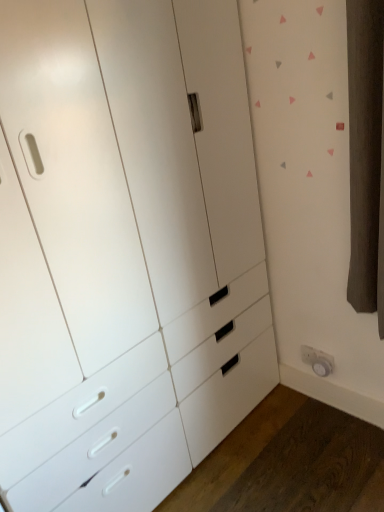
Question: From a real-world perspective, is white matte chest of drawers at center located beneath white plastic electric outlet at lower right?

Choices:
 (A) yes
 (B) no

Answer: (B)

Question: Can you confirm if white matte chest of drawers at center is wider than white plastic electric outlet at lower right?

Choices:
 (A) yes
 (B) no

Answer: (A)

Question: From the image's perspective, is white matte chest of drawers at center under white plastic electric outlet at lower right?

Choices:
 (A) no
 (B) yes

Answer: (A)

Question: Does white matte chest of drawers at center have a larger size compared to white plastic electric outlet at lower right?

Choices:
 (A) yes
 (B) no

Answer: (A)

Question: Is white matte chest of drawers at center not within white plastic electric outlet at lower right?

Choices:
 (A) yes
 (B) no

Answer: (A)

Question: Would you say white plastic electric outlet at lower right is part of white matte chest of drawers at center's contents?

Choices:
 (A) yes
 (B) no

Answer: (B)

Question: Considering the relative sizes of white plastic electric outlet at lower right and white matte chest of drawers at center in the image provided, is white plastic electric outlet at lower right taller than white matte chest of drawers at center?

Choices:
 (A) no
 (B) yes

Answer: (A)

Question: Is white plastic electric outlet at lower right positioned far away from white matte chest of drawers at center?

Choices:
 (A) yes
 (B) no

Answer: (B)

Question: Is white plastic electric outlet at lower right further to the viewer compared to white matte chest of drawers at center?

Choices:
 (A) no
 (B) yes

Answer: (B)

Question: Is white plastic electric outlet at lower right not inside white matte chest of drawers at center?

Choices:
 (A) no
 (B) yes

Answer: (B)

Question: Is white plastic electric outlet at lower right shorter than white matte chest of drawers at center?

Choices:
 (A) no
 (B) yes

Answer: (B)

Question: Is white matte chest of drawers at center completely or partially inside white plastic electric outlet at lower right?

Choices:
 (A) yes
 (B) no

Answer: (B)

Question: Looking at their shapes, would you say white matte chest of drawers at center is wider or thinner than white plastic electric outlet at lower right?

Choices:
 (A) thin
 (B) wide

Answer: (B)